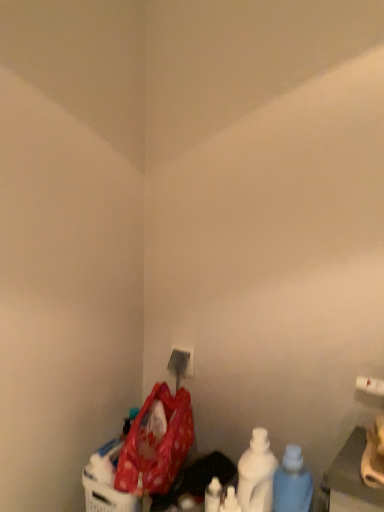
Question: From the image's perspective, is blue translucent bottle at lower right, which appears as the 1th bottle when viewed from the right, above or below white matte bottle at lower right, acting as the second bottle starting from the right?

Choices:
 (A) above
 (B) below

Answer: (B)

Question: Looking at their shapes, would you say blue translucent bottle at lower right, the third bottle viewed from the left, is wider or thinner than white matte bottle at lower right, acting as the second bottle starting from the right?

Choices:
 (A) wide
 (B) thin

Answer: (A)

Question: Considering the real-world distances, which object is closest to the white plastic electric outlet at lower center?

Choices:
 (A) white matte bottle at lower right, acting as the second bottle starting from the right
 (B) blue translucent bottle at lower right, the third bottle viewed from the left
 (C) polka dot fabric bag at lower left
 (D) white matte bottle at lower center, arranged as the first bottle when viewed from the left

Answer: (C)

Question: Which object is positioned farthest from the polka dot fabric bag at lower left?

Choices:
 (A) white matte bottle at lower center, arranged as the first bottle when viewed from the left
 (B) white matte bottle at lower right, acting as the second bottle starting from the right
 (C) blue translucent bottle at lower right, the third bottle viewed from the left
 (D) white plastic electric outlet at lower center

Answer: (C)